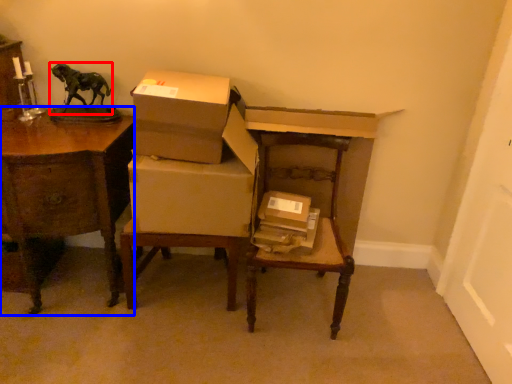
Question: Which of the following is the closest to the observer, animal (highlighted by a red box) or desk (highlighted by a blue box)?

Choices:
 (A) animal
 (B) desk

Answer: (B)